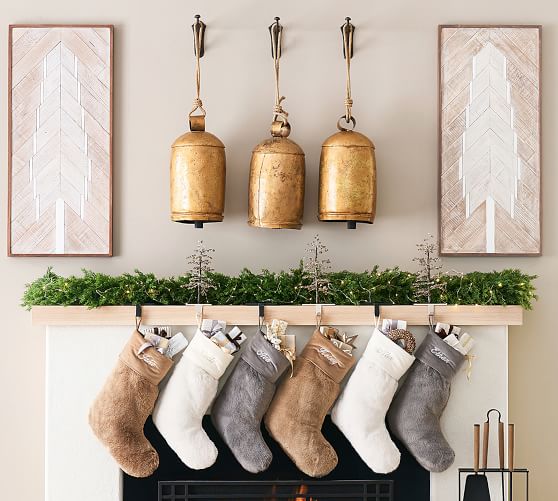
I want to click on hook, so click(199, 18), click(266, 34), click(336, 38).